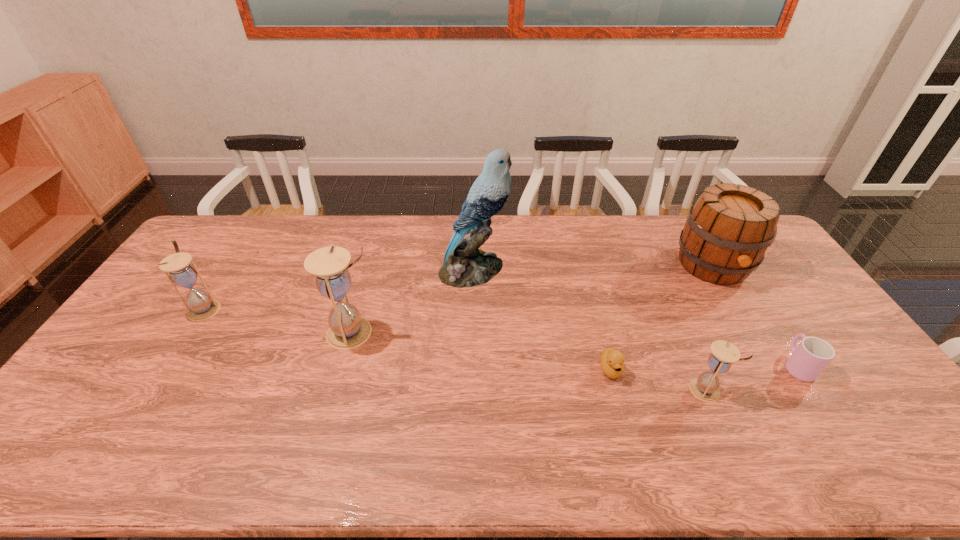
Identify the location of the shortest object. The height and width of the screenshot is (540, 960). (612, 361).

At what (x,y) coordinates should I click in order to perform the action: click on duckling. Please return your answer as a coordinate pair (x, y). Looking at the image, I should click on (612, 361).

The width and height of the screenshot is (960, 540). In order to click on vacant space located 0.280m on the front of the leftmost object in this screenshot , I will do `click(145, 403)`.

The image size is (960, 540). I want to click on vacant space located on the left of the second hourglass from left to right, so click(x=279, y=333).

Identify the location of free space located 0.060m on the right of the third shortest object. The height and width of the screenshot is (540, 960). (745, 390).

Identify the location of vacant space located on the side of the cider where the spigot is located. (746, 319).

This screenshot has height=540, width=960. Find the location of `free spot located on the face of the tallest object`. free spot located on the face of the tallest object is located at coordinates (565, 269).

At what (x,y) coordinates should I click in order to perform the action: click on free space located with the handle on the side of the cup. Please return your answer as a coordinate pair (x, y). Looking at the image, I should click on (730, 261).

The image size is (960, 540). In order to click on free space located with the handle on the side of the cup in this screenshot , I will do `click(732, 265)`.

This screenshot has height=540, width=960. Identify the location of vacant space positioned 0.220m with the handle on the side of the cup. (752, 295).